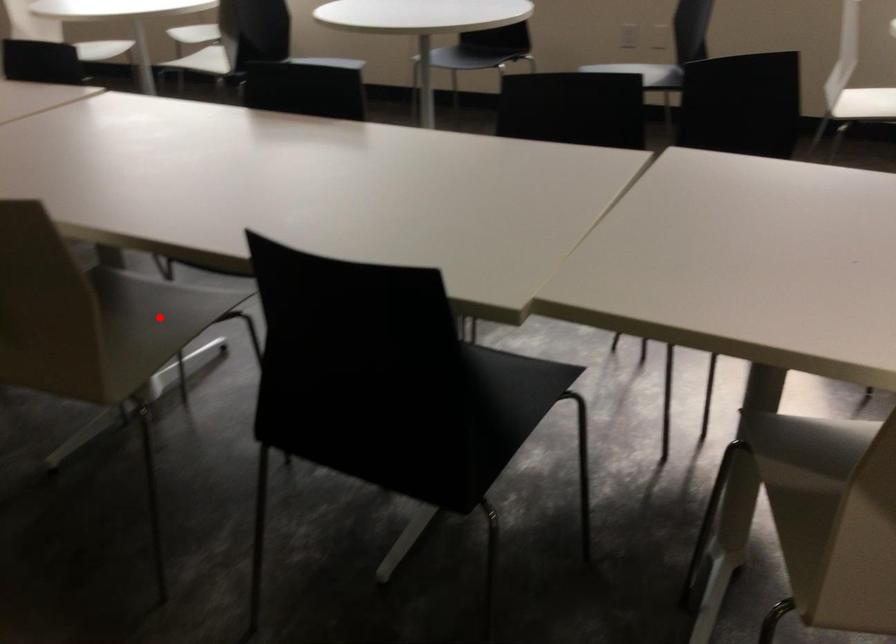
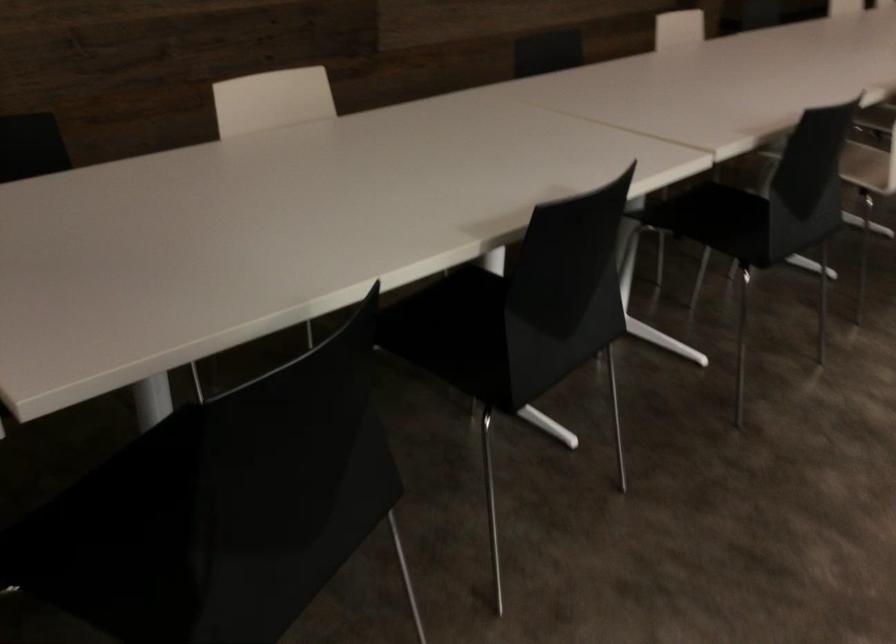
Question: I am providing you with two images of the same scene from different viewpoints. A red point is marked on the first image. Can you still see the location of the red point in image 2?

Choices:
 (A) Yes
 (B) No

Answer: (B)